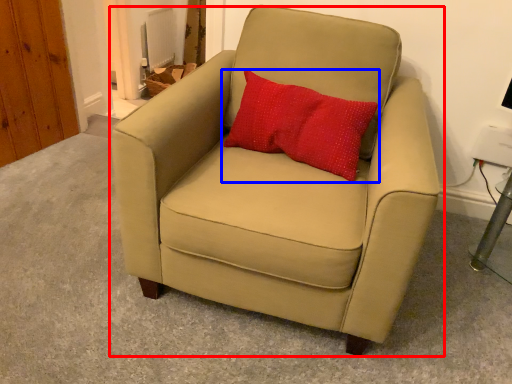
Question: Which object is further to the camera taking this photo, chair (highlighted by a red box) or pillow (highlighted by a blue box)?

Choices:
 (A) chair
 (B) pillow

Answer: (B)